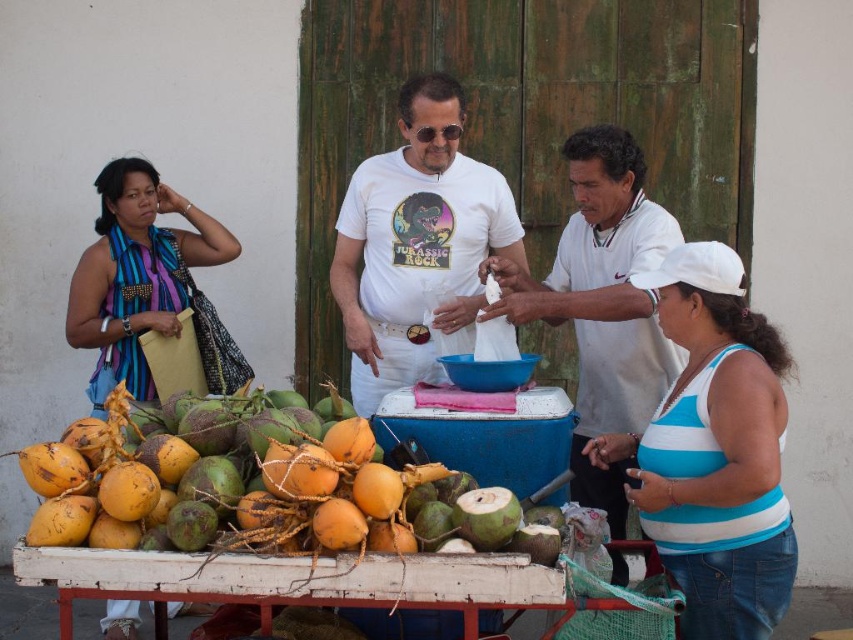
You are a street performer carrying a 1.5 meter long pole. You need to move from the blue striped scarf at left to the white cotton shirt at center without dropping the pole. Is there enough space between them to move safely?

The distance between the white cotton shirt at center and the blue striped scarf at left is 1.69 meters. Since the pole is 1.5 meters long, there is sufficient space to move safely as the distance is greater than the pole length.